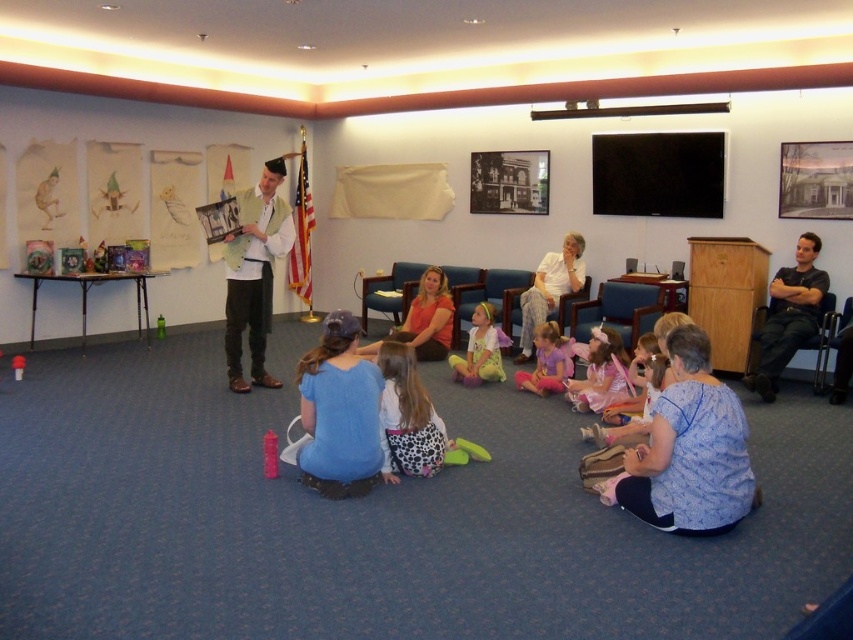
Does dotted fabric pants at center appear on the left side of light blue fabric chair at center?

In fact, dotted fabric pants at center is to the right of light blue fabric chair at center.

Based on the photo, does dotted fabric pants at center have a larger size compared to light blue fabric chair at center?

No.

This screenshot has height=640, width=853. I want to click on dotted fabric pants at center, so click(x=413, y=420).

Can you confirm if light brown leather jacket at center is positioned to the right of light blue fabric chair at center?

No, light brown leather jacket at center is not to the right of light blue fabric chair at center.

Can you confirm if light brown leather jacket at center is positioned below light blue fabric chair at center?

Yes, light brown leather jacket at center is below light blue fabric chair at center.

Which is in front, point (274, 208) or point (376, 280)?

Point (274, 208) is in front.

Where is `light brown leather jacket at center`? light brown leather jacket at center is located at coordinates (254, 273).

Does dotted fabric pants at center lie in front of blue fabric chair at center?

Yes, dotted fabric pants at center is in front of blue fabric chair at center.

Based on the photo, which of these two, dotted fabric pants at center or blue fabric chair at center, stands shorter?

With less height is blue fabric chair at center.

Measure the distance between dotted fabric pants at center and camera.

They are 12.28 feet apart.

Locate an element on the screen. The image size is (853, 640). dotted fabric pants at center is located at coordinates (413, 420).